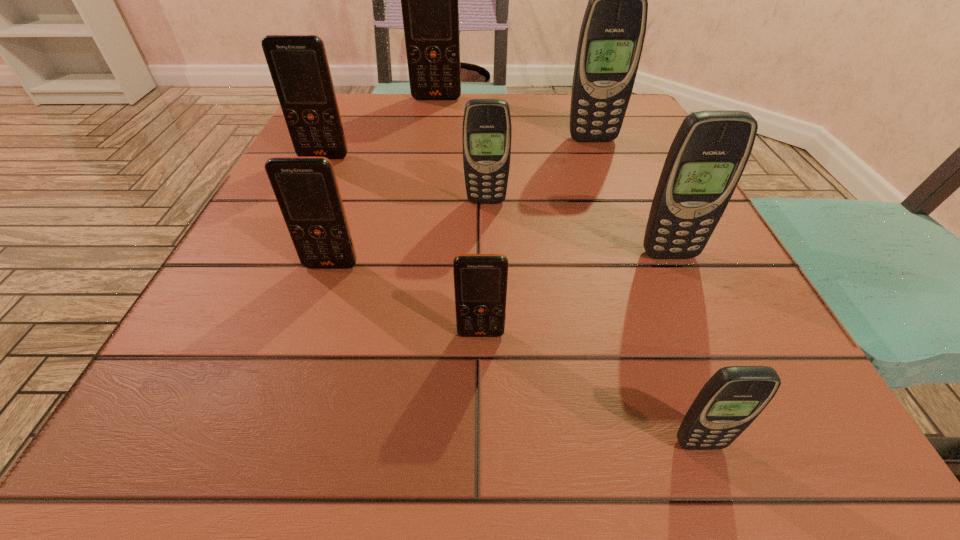
Find the location of a particular element. the third nearest cellular telephone is located at coordinates (306, 189).

Find the location of a particular element. The height and width of the screenshot is (540, 960). the third biggest orange cellular telephone is located at coordinates (306, 189).

At what (x,y) coordinates should I click in order to perform the action: click on the second nearest object. Please return your answer as a coordinate pair (x, y). This screenshot has width=960, height=540. Looking at the image, I should click on (480, 280).

Find the location of a particular element. The image size is (960, 540). the smallest orange cellular telephone is located at coordinates (480, 280).

The height and width of the screenshot is (540, 960). Find the location of `the smallest gray cellular telephone`. the smallest gray cellular telephone is located at coordinates (734, 396).

I want to click on the nearest cellular telephone, so click(734, 396).

Find the location of a particular element. free space located 0.270m on the screen of the farthest cellular telephone is located at coordinates (427, 159).

This screenshot has width=960, height=540. What are the coordinates of `free space located 0.380m on the screen of the biggest gray cellular telephone` in the screenshot? It's located at (640, 269).

The height and width of the screenshot is (540, 960). In order to click on blank area located 0.390m on the screen of the third farthest cellular telephone in this screenshot , I will do `click(250, 310)`.

Identify the location of blank space located on the screen of the fifth farthest object. The image size is (960, 540). (682, 284).